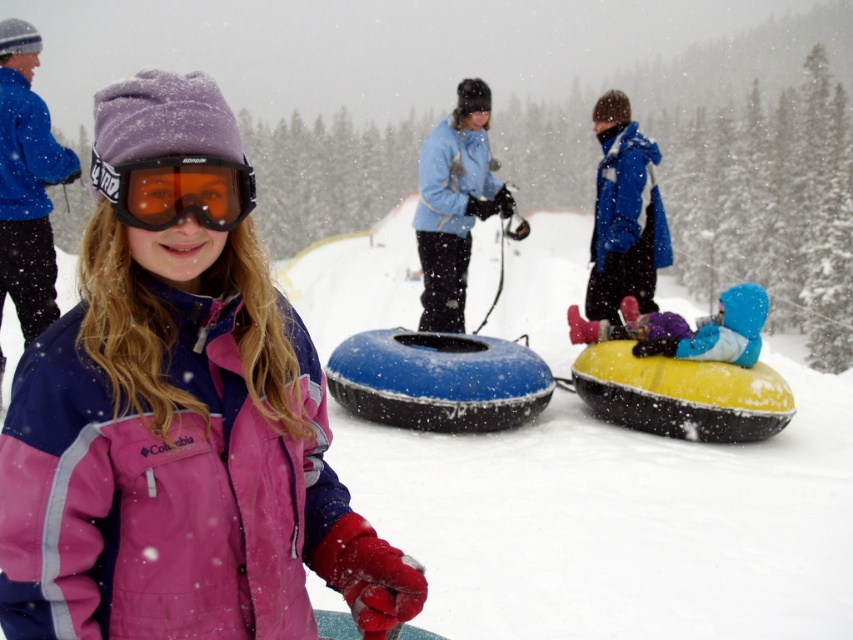
Is blue matte jacket at center closer to the viewer compared to black matte goggles at center?

No.

Is blue matte jacket at center smaller than black matte goggles at center?

Incorrect, blue matte jacket at center is not smaller in size than black matte goggles at center.

Which is behind, point (640, 198) or point (178, 211)?

Point (640, 198)

Image resolution: width=853 pixels, height=640 pixels. What are the coordinates of `blue matte jacket at center` in the screenshot? It's located at (624, 214).

Does white fluffy snow at center appear under black matte goggles at center?

No, white fluffy snow at center is not below black matte goggles at center.

Does white fluffy snow at center have a lesser height compared to black matte goggles at center?

Incorrect, white fluffy snow at center's height does not fall short of black matte goggles at center's.

Between point (585, 557) and point (111, 170), which one is positioned behind?

Point (585, 557)

Where is `white fluffy snow at center`? Image resolution: width=853 pixels, height=640 pixels. white fluffy snow at center is located at coordinates (619, 518).

Is black matte goggles at center smaller than blue fabric snowsuit at center?

Yes.

Does black matte goggles at center appear under blue fabric snowsuit at center?

No, black matte goggles at center is not below blue fabric snowsuit at center.

Where is `black matte goggles at center`? The width and height of the screenshot is (853, 640). black matte goggles at center is located at coordinates (177, 189).